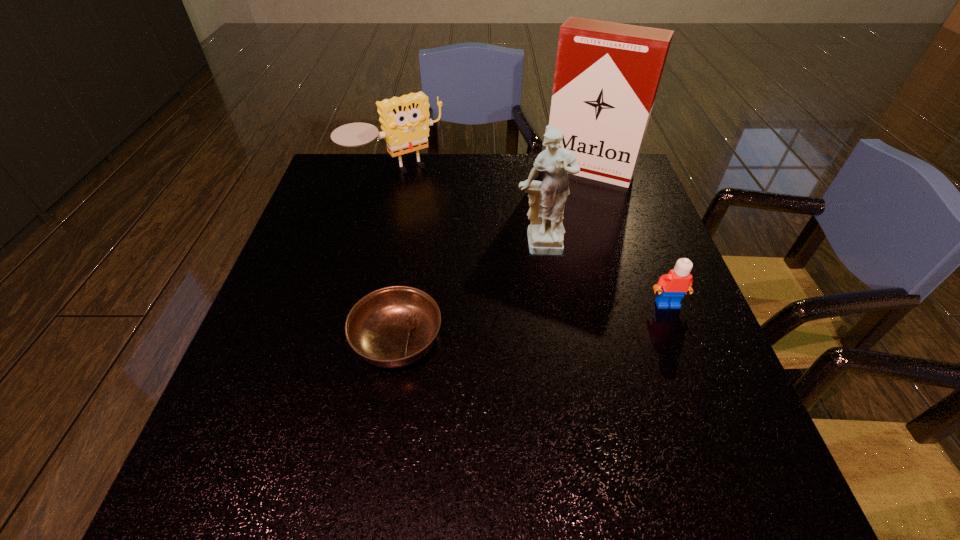
Where is `empty space between the Lego and the soup bowl`? This screenshot has width=960, height=540. empty space between the Lego and the soup bowl is located at coordinates (532, 322).

The image size is (960, 540). I want to click on vacant area between the sponge and the third nearest object, so click(x=468, y=210).

Locate an element on the screen. The width and height of the screenshot is (960, 540). vacant area that lies between the sponge and the cigarette_case is located at coordinates (492, 172).

This screenshot has height=540, width=960. What are the coordinates of `vacant area that lies between the second tallest object and the shortest object` in the screenshot? It's located at (468, 294).

I want to click on vacant area that lies between the tallest object and the soup bowl, so click(493, 255).

You are a GUI agent. You are given a task and a screenshot of the screen. Output one action in this format:
    pyautogui.click(x=<x>, y=<y>)
    Task: Click on the vacant space that is in between the fourth shortest object and the fourth tallest object
    
    Given the screenshot: What is the action you would take?
    pyautogui.click(x=603, y=275)

Identify the location of vacant space that's between the soup bowl and the Lego. (532, 322).

Where is `empty location between the cigarette_case and the sponge`? Image resolution: width=960 pixels, height=540 pixels. empty location between the cigarette_case and the sponge is located at coordinates (492, 172).

Choose which object is the nearest neighbor to the third tallest object. Please provide its 2D coordinates. Your answer should be formatted as a tuple, i.e. [(x, y)], where the tuple contains the x and y coordinates of a point satisfying the conditions above.

[(547, 199)]

Where is `object that is the second nearest to the soup bowl`? This screenshot has width=960, height=540. object that is the second nearest to the soup bowl is located at coordinates (405, 122).